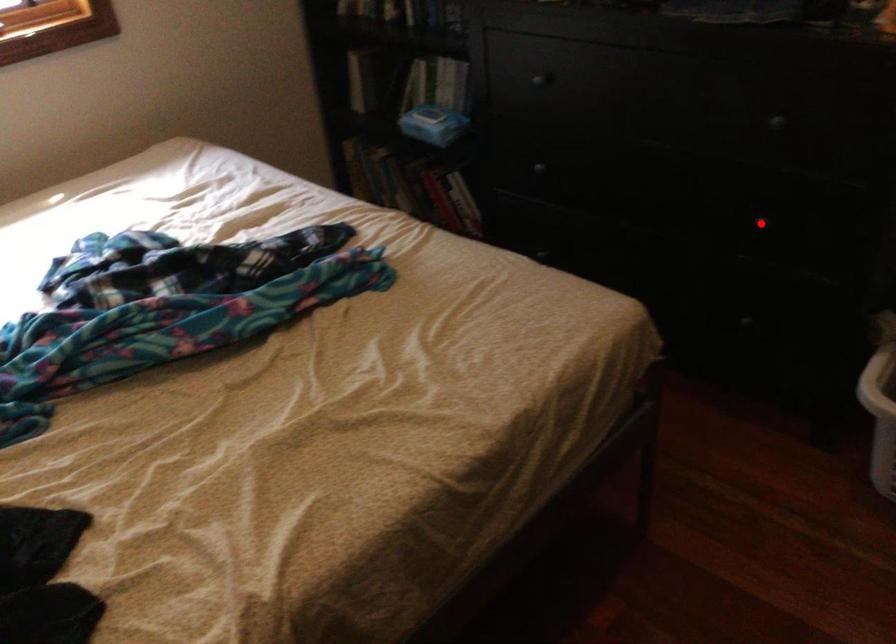
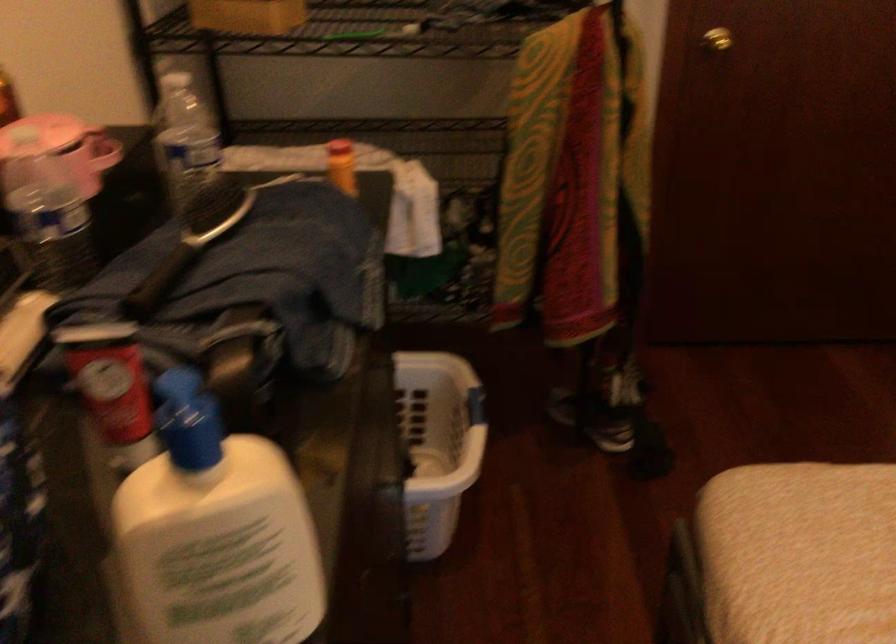
Question: I am providing you with two images of the same scene from different viewpoints. A red point is marked on the first image. Can you still see the location of the red point in image 2?

Choices:
 (A) Yes
 (B) No

Answer: (B)